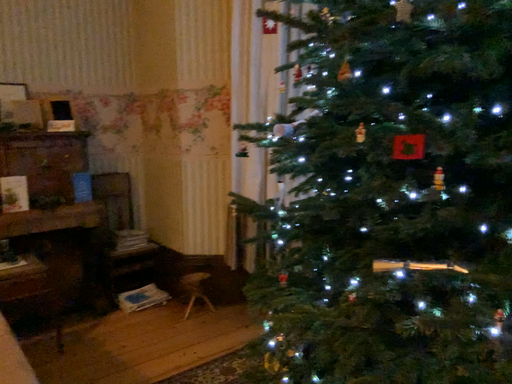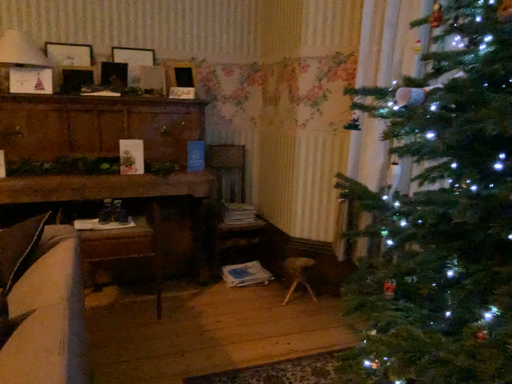
Question: Which way did the camera rotate in the video?

Choices:
 (A) rotated right
 (B) rotated left

Answer: (B)